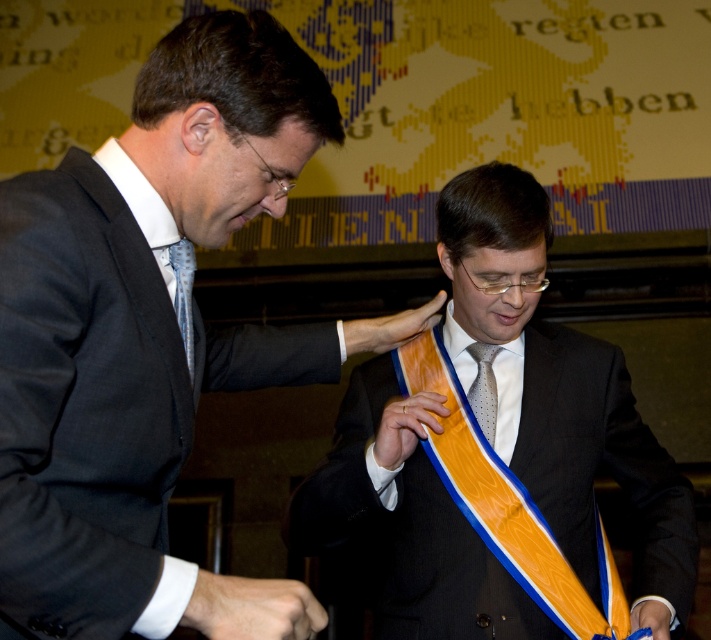
Question: Can you confirm if matte black suit at center is positioned to the left of polka dot silk tie at center?

Choices:
 (A) no
 (B) yes

Answer: (B)

Question: Considering the relative positions of matte black suit at center and orange satin sash at center in the image provided, where is matte black suit at center located with respect to orange satin sash at center?

Choices:
 (A) right
 (B) left

Answer: (B)

Question: Among these points, which one is nearest to the camera?

Choices:
 (A) (476, 372)
 (B) (464, 260)
 (C) (169, 161)

Answer: (C)

Question: Can you confirm if blue dotted tie at left is positioned to the right of polka dot silk tie at center?

Choices:
 (A) no
 (B) yes

Answer: (A)

Question: Which object is the farthest from the matte black suit at center?

Choices:
 (A) blue dotted tie at left
 (B) orange satin sash at center

Answer: (B)

Question: Which point is closer to the camera?

Choices:
 (A) blue dotted tie at left
 (B) polka dot silk tie at center
 (C) orange satin sash at center

Answer: (A)